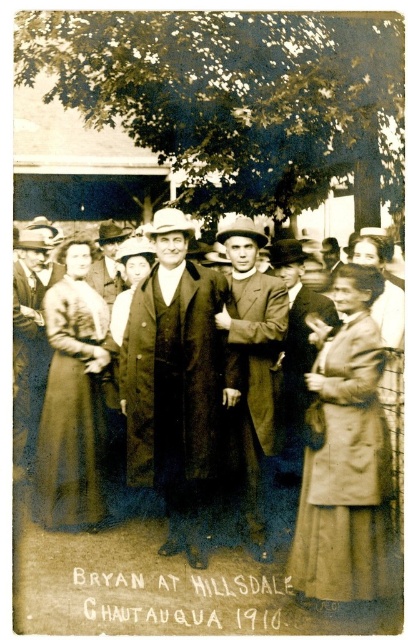
In the scene shown: Does dark brown wool coat at center come behind matte brown dress at center?

No, it is in front of matte brown dress at center.

Which of these two, dark brown wool coat at center or matte brown dress at center, stands taller?

With more height is dark brown wool coat at center.

Where is `dark brown wool coat at center`? Image resolution: width=408 pixels, height=640 pixels. dark brown wool coat at center is located at coordinates (175, 381).

Which is behind, point (339, 368) or point (104, 234)?

Point (104, 234)

Does light brown fabric coat at right lie in front of dark brown suit at center?

Yes, light brown fabric coat at right is in front of dark brown suit at center.

You are a GUI agent. You are given a task and a screenshot of the screen. Output one action in this format:
    pyautogui.click(x=<x>, y=<y>)
    Task: Click on the light brown fabric coat at right
    
    Given the screenshot: What is the action you would take?
    pyautogui.click(x=345, y=456)

Which is in front, point (252, 419) or point (19, 257)?

Point (252, 419) is in front.

Between matte brown coat at center and matte black coat at left, which one is positioned lower?

matte brown coat at center is lower down.

Does point (270, 307) come farther from viewer compared to point (44, 280)?

That is False.

The width and height of the screenshot is (408, 640). Identify the location of matte brown coat at center. (254, 355).